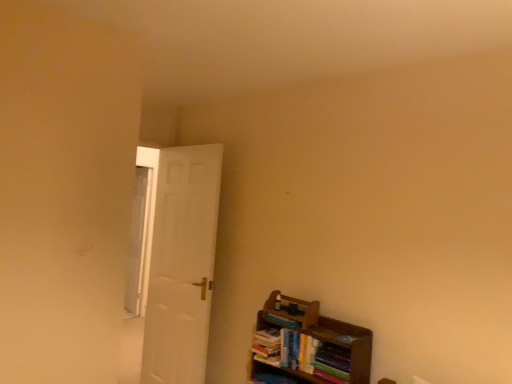
Question: Should I look upward or downward to see clear glass window at left?

Choices:
 (A) up
 (B) down

Answer: (B)

Question: Does wooden bookshelf at lower right appear on the right side of clear glass window at left?

Choices:
 (A) yes
 (B) no

Answer: (A)

Question: From a real-world perspective, is wooden bookshelf at lower right located beneath clear glass window at left?

Choices:
 (A) yes
 (B) no

Answer: (A)

Question: Would you say wooden bookshelf at lower right contains clear glass window at left?

Choices:
 (A) no
 (B) yes

Answer: (A)

Question: Does wooden bookshelf at lower right have a lesser width compared to clear glass window at left?

Choices:
 (A) no
 (B) yes

Answer: (A)

Question: Is wooden bookshelf at lower right far from clear glass window at left?

Choices:
 (A) no
 (B) yes

Answer: (B)

Question: Does wooden bookshelf at lower right touch clear glass window at left?

Choices:
 (A) no
 (B) yes

Answer: (A)

Question: From a real-world perspective, is hardcover books at lower right, acting as the 2th book starting from the top, under white matte door at left?

Choices:
 (A) yes
 (B) no

Answer: (A)

Question: Does hardcover books at lower right, positioned as the 1th book in bottom-to-top order, turn towards white matte door at left?

Choices:
 (A) no
 (B) yes

Answer: (A)

Question: From the image's perspective, would you say hardcover books at lower right, acting as the 2th book starting from the top, is shown under white matte door at left?

Choices:
 (A) no
 (B) yes

Answer: (B)

Question: Is hardcover books at lower right, positioned as the 1th book in bottom-to-top order, outside white matte door at left?

Choices:
 (A) yes
 (B) no

Answer: (A)

Question: Would you say white matte door at left is part of hardcover books at lower right, acting as the 2th book starting from the top,'s contents?

Choices:
 (A) yes
 (B) no

Answer: (B)

Question: Is the depth of hardcover books at lower right, positioned as the 1th book in bottom-to-top order, greater than that of white matte door at left?

Choices:
 (A) no
 (B) yes

Answer: (A)

Question: Is white matte door at left next to hardcover books at lower right, acting as the 2th book starting from the top?

Choices:
 (A) yes
 (B) no

Answer: (B)